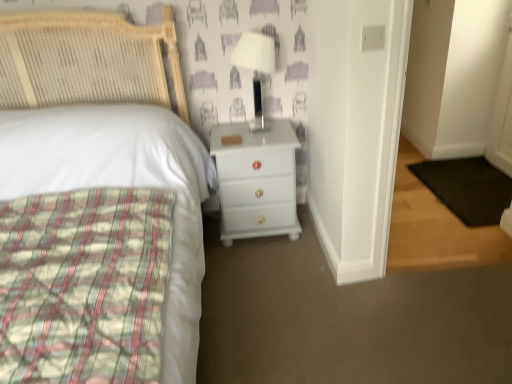
At what (x,y) coordinates should I click in order to perform the action: click on white glossy chest of drawers at center. Please return your answer as a coordinate pair (x, y). The height and width of the screenshot is (384, 512). Looking at the image, I should click on (256, 180).

Find the location of a particular element. white glossy lamp at upper right is located at coordinates click(256, 68).

Is point (252, 32) positioned in front of point (254, 141)?

No, it is behind (254, 141).

Who is taller, white glossy lamp at upper right or white glossy chest of drawers at center?

Standing taller between the two is white glossy chest of drawers at center.

Which of these two, white glossy lamp at upper right or white woven headboard at upper left, is bigger?

white woven headboard at upper left is bigger.

Is white glossy lamp at upper right aimed at white woven headboard at upper left?

No.

From the image's perspective, is white glossy lamp at upper right below white woven headboard at upper left?

No, from the image's perspective, white glossy lamp at upper right is not beneath white woven headboard at upper left.

You are a GUI agent. You are given a task and a screenshot of the screen. Output one action in this format:
    pyautogui.click(x=<x>, y=<y>)
    Task: Click on the bed in front of the white glossy lamp at upper right
    The height and width of the screenshot is (384, 512).
    Given the screenshot: What is the action you would take?
    pyautogui.click(x=108, y=135)

Would you say white woven headboard at upper left is a long distance from white glossy lamp at upper right?

They are positioned close to each other.

From the image's perspective, between white woven headboard at upper left and white glossy lamp at upper right, who is located below?

white woven headboard at upper left appears lower in the image.

Between white woven headboard at upper left and white glossy lamp at upper right, which one has smaller width?

white glossy lamp at upper right.

I want to click on the chest of drawers that is under the white glossy lamp at upper right (from a real-world perspective), so click(256, 180).

Which object is further away from the camera taking this photo, white glossy chest of drawers at center or white glossy lamp at upper right?

white glossy chest of drawers at center is further from the camera.

Looking at this image, is white glossy chest of drawers at center not near white glossy lamp at upper right?

No, white glossy chest of drawers at center is in close proximity to white glossy lamp at upper right.

From the image's perspective, between white glossy chest of drawers at center and white glossy lamp at upper right, which one is located above?

white glossy lamp at upper right.

Considering the sizes of objects white glossy chest of drawers at center and white woven headboard at upper left in the image provided, who is taller, white glossy chest of drawers at center or white woven headboard at upper left?

white woven headboard at upper left is taller.

Measure the distance from white glossy chest of drawers at center to white woven headboard at upper left.

They are 16.27 inches apart.

Is white woven headboard at upper left completely or partially inside white glossy chest of drawers at center?

No, white woven headboard at upper left is not a part of white glossy chest of drawers at center.

From a real-world perspective, is white glossy chest of drawers at center under white woven headboard at upper left?

Yes, from a real-world perspective, white glossy chest of drawers at center is beneath white woven headboard at upper left.

Considering the relative sizes of white woven headboard at upper left and white glossy chest of drawers at center in the image provided, is white woven headboard at upper left taller than white glossy chest of drawers at center?

Yes, white woven headboard at upper left is taller than white glossy chest of drawers at center.

From the image's perspective, who appears lower, white woven headboard at upper left or white glossy chest of drawers at center?

From the image's view, white woven headboard at upper left is below.

Can we say white woven headboard at upper left lies outside white glossy chest of drawers at center?

white woven headboard at upper left lies outside white glossy chest of drawers at center's area.

Considering the relative sizes of white woven headboard at upper left and white glossy chest of drawers at center in the image provided, is white woven headboard at upper left thinner than white glossy chest of drawers at center?

No.

In the image, there is a white glossy lamp at upper right. Identify the location of the chest of drawers below it (from the image's perspective). The height and width of the screenshot is (384, 512). (256, 180).

At what (x,y) coordinates should I click in order to perform the action: click on bed on the left of white glossy lamp at upper right. Please return your answer as a coordinate pair (x, y). Looking at the image, I should click on click(x=108, y=135).

When comparing their distances from white woven headboard at upper left, does white glossy chest of drawers at center or white glossy lamp at upper right seem further?

white glossy lamp at upper right is positioned further to the anchor white woven headboard at upper left.

Considering their positions, is white glossy lamp at upper right positioned further to white glossy chest of drawers at center than white woven headboard at upper left?

white glossy lamp at upper right lies further to white glossy chest of drawers at center than the other object.

Looking at the image, which one is located closer to white glossy lamp at upper right, white glossy chest of drawers at center or white woven headboard at upper left?

white glossy chest of drawers at center lies closer to white glossy lamp at upper right than the other object.

Consider the image. Considering their positions, is white woven headboard at upper left positioned further to white glossy chest of drawers at center than white glossy lamp at upper right?

white glossy lamp at upper right is positioned further to the anchor white glossy chest of drawers at center.

From the image, which object appears to be nearer to white glossy lamp at upper right, white woven headboard at upper left or white glossy chest of drawers at center?

Based on the image, white glossy chest of drawers at center appears to be nearer to white glossy lamp at upper right.

From the image, which object appears to be farther from white woven headboard at upper left, white glossy lamp at upper right or white glossy chest of drawers at center?

The object further to white woven headboard at upper left is white glossy lamp at upper right.

The height and width of the screenshot is (384, 512). In order to click on lamp between white woven headboard at upper left and white glossy chest of drawers at center along the z-axis in this screenshot , I will do `click(256, 68)`.